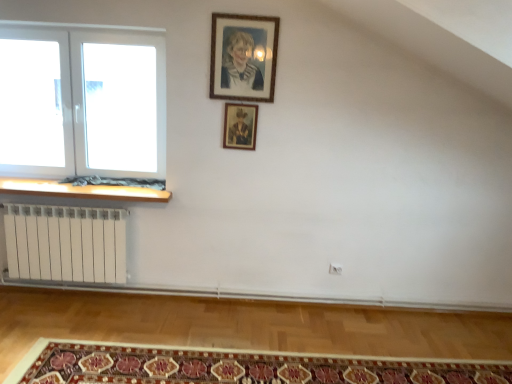
At what (x,y) coordinates should I click in order to perform the action: click on blank space situated above wooden at left (from a real-world perspective). Please return your answer as a coordinate pair (x, y). Looking at the image, I should click on (80, 187).